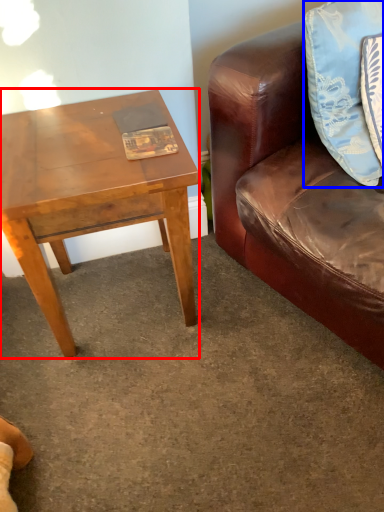
Question: Which of the following is the closest to the observer, coffee table (highlighted by a red box) or pillow (highlighted by a blue box)?

Choices:
 (A) coffee table
 (B) pillow

Answer: (B)